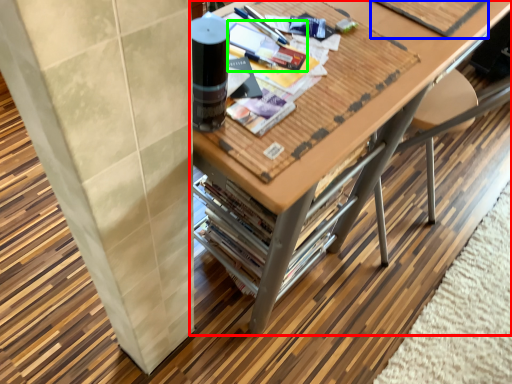
Question: Which object is the farthest from table (highlighted by a red box)? Choose among these: magazine (highlighted by a blue box) or magazine (highlighted by a green box).

Choices:
 (A) magazine
 (B) magazine

Answer: (B)